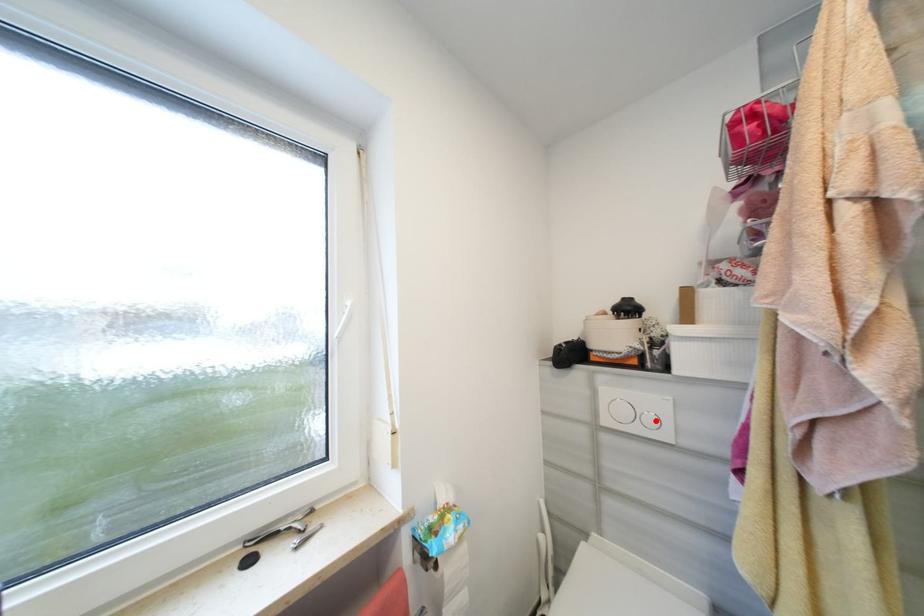
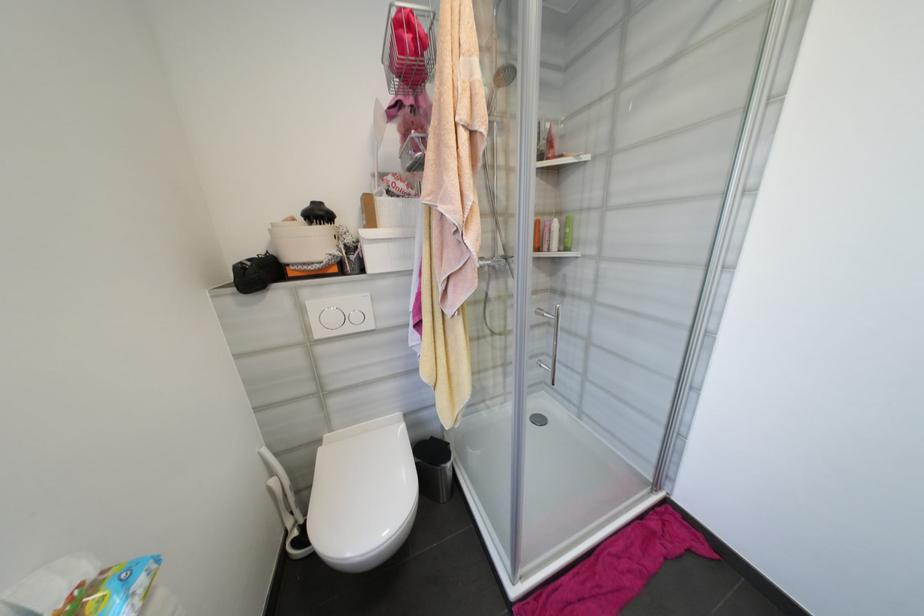
Locate, in the second image, the point that corresponds to the highlighted location in the first image.

(361, 318)